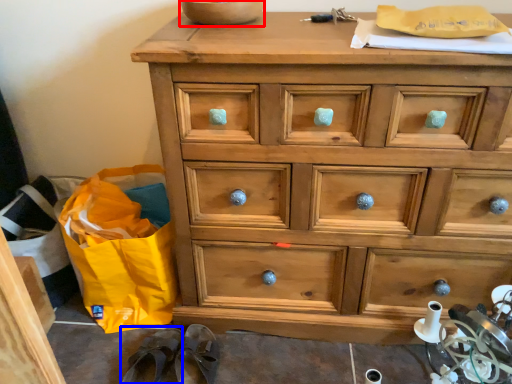
Question: Among these objects, which one is nearest to the camera, bowl (highlighted by a red box) or slipper (highlighted by a blue box)?

Choices:
 (A) bowl
 (B) slipper

Answer: (A)